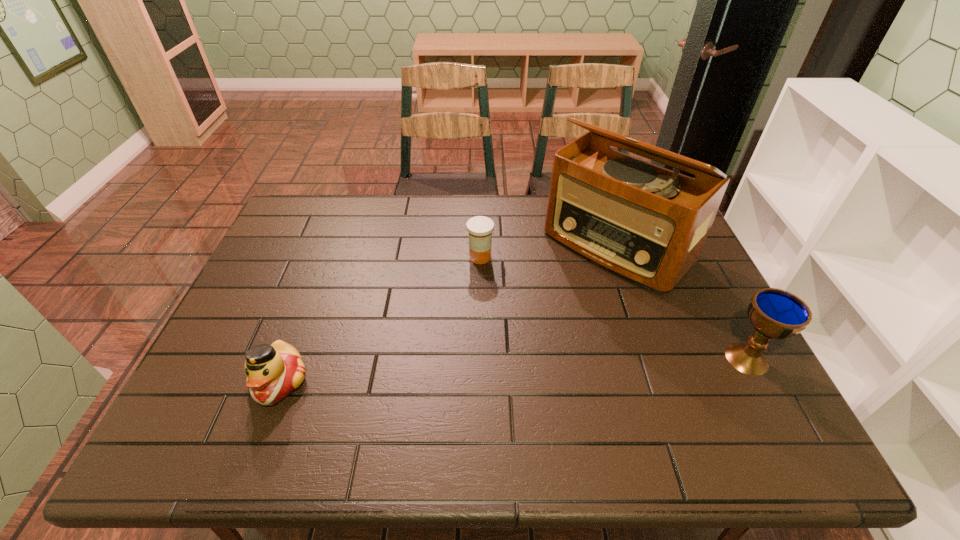
The image size is (960, 540). Find the location of `vacant point located between the duck and the chalice`. vacant point located between the duck and the chalice is located at coordinates (514, 370).

Identify the location of vacant region between the medicine and the radio receiver. This screenshot has width=960, height=540. (549, 251).

Locate an element on the screen. The height and width of the screenshot is (540, 960). unoccupied area between the tallest object and the second object from left to right is located at coordinates (549, 251).

At what (x,y) coordinates should I click in order to perform the action: click on empty location between the duck and the second object from left to right. Please return your answer as a coordinate pair (x, y). Looking at the image, I should click on (380, 319).

Locate an element on the screen. free point between the third object from right to left and the duck is located at coordinates (380, 319).

Where is `free space between the tallest object and the leftmost object`? free space between the tallest object and the leftmost object is located at coordinates (448, 313).

Where is `object that is the second closest to the duck`? object that is the second closest to the duck is located at coordinates (648, 224).

Select which object appears as the third closest to the leftmost object. Please provide its 2D coordinates. Your answer should be formatted as a tuple, i.e. [(x, y)], where the tuple contains the x and y coordinates of a point satisfying the conditions above.

[(774, 313)]

Identify the location of vacant space that satisfies the following two spatial constraints: 1. on the front side of the second object from left to right; 2. on the right side of the chalice. (480, 359).

What are the coordinates of `vacant region that satisfies the following two spatial constraints: 1. on the back side of the radio receiver; 2. on the right side of the medicine` in the screenshot? It's located at (480, 245).